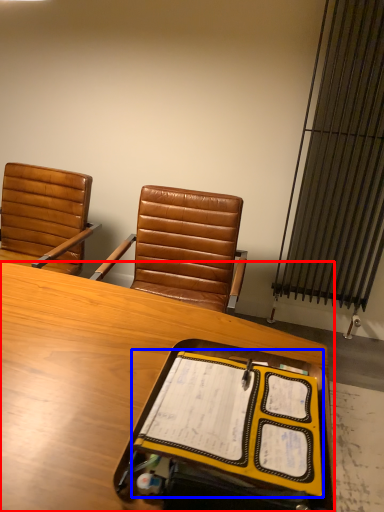
Question: Which object is further to the camera taking this photo, desk (highlighted by a red box) or notebook (highlighted by a blue box)?

Choices:
 (A) desk
 (B) notebook

Answer: (B)